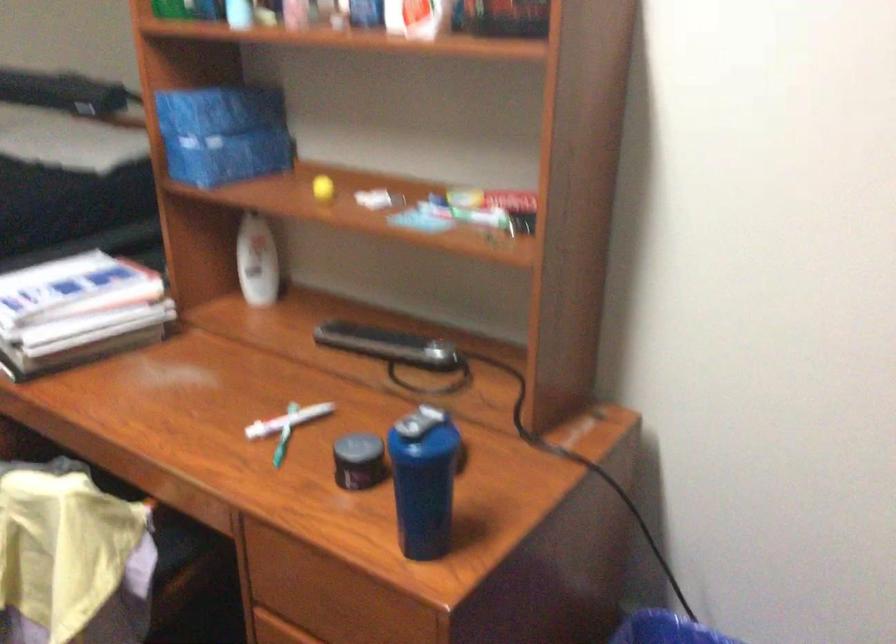
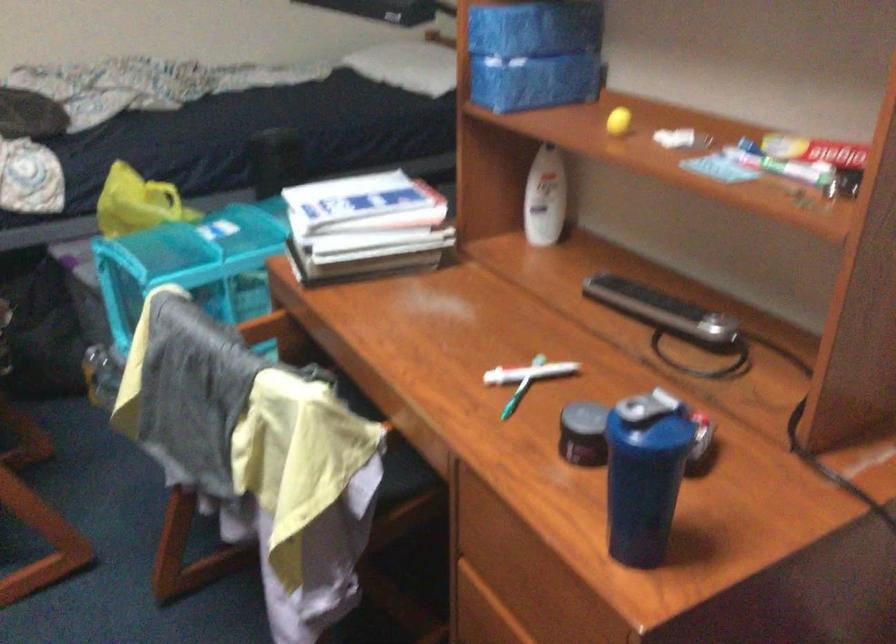
Locate, in the second image, the point that corresponds to pixel 428 482 in the first image.

(644, 474)